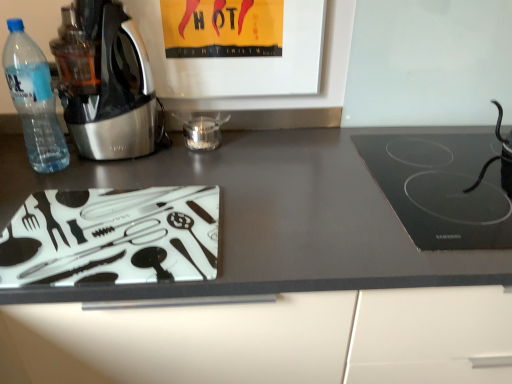
Where is `free space in front of transparent glass jar at center, arranged as the first appliance when viewed from the left`? free space in front of transparent glass jar at center, arranged as the first appliance when viewed from the left is located at coordinates (207, 166).